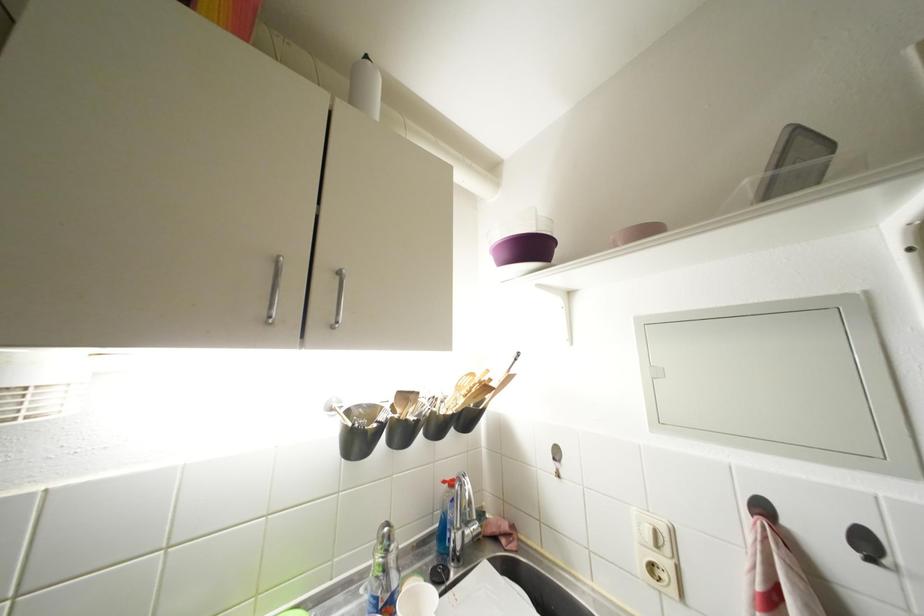
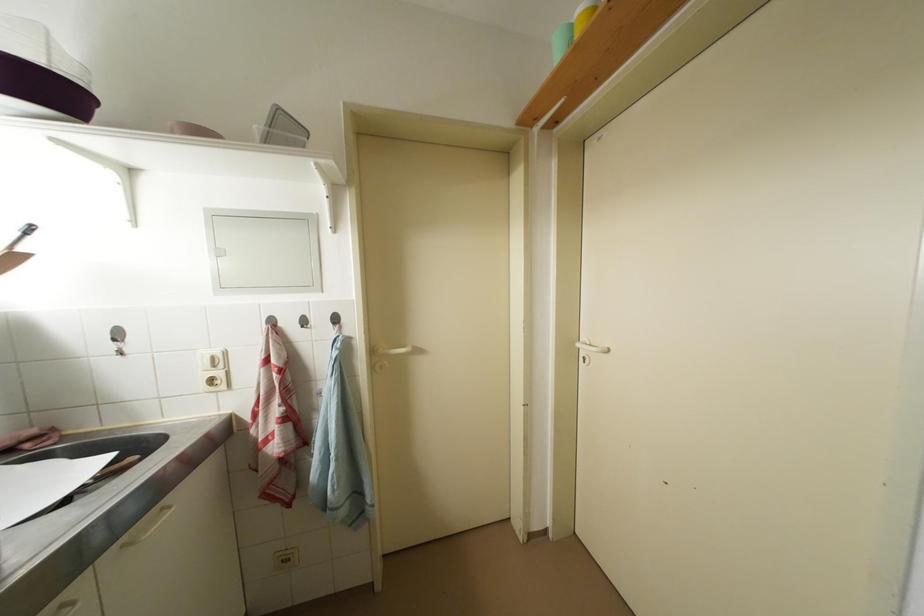
Question: The camera is either moving clockwise (left) or counter-clockwise (right) around the object. The first image is from the beginning of the video and the second image is from the end. Is the camera moving left or right when shooting the video?

Choices:
 (A) Left
 (B) Right

Answer: (A)